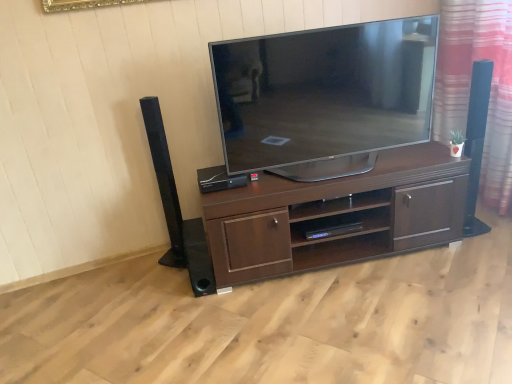
Locate an element on the screen. free space in front of black matte speaker at lower center, the 2th speaker from the right is located at coordinates (200, 306).